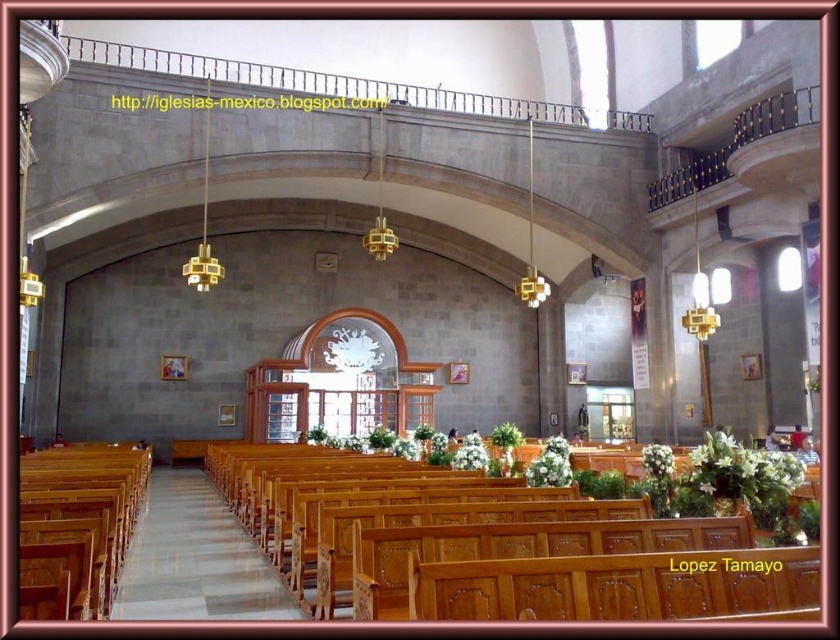
Is white floral arrangement at center positioned at the back of white matte flower at center?

No.

Is white floral arrangement at center above white matte flower at center?

Incorrect, white floral arrangement at center is not positioned above white matte flower at center.

Which is in front, point (563, 444) or point (667, 449)?

Point (667, 449) is more forward.

This screenshot has width=840, height=640. In order to click on white floral arrangement at center in this screenshot , I will do `click(550, 465)`.

Is white floral arrangement at center below white matte floral arrangement at center?

Yes.

In order to click on white floral arrangement at center in this screenshot , I will do `click(550, 465)`.

Does white matte floral arrangement at center lie behind white matte flower at center?

That is False.

Identify the location of white matte floral arrangement at center. (470, 454).